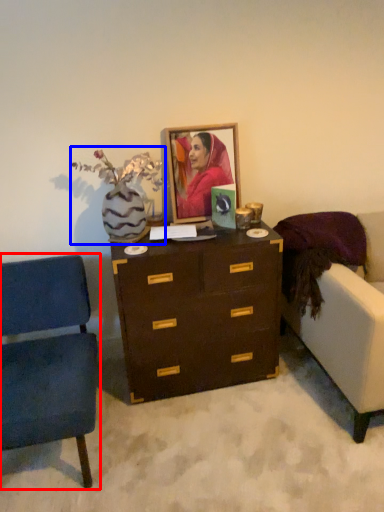
Question: Which object is further to the camera taking this photo, chair (highlighted by a red box) or floral arrangement (highlighted by a blue box)?

Choices:
 (A) chair
 (B) floral arrangement

Answer: (B)